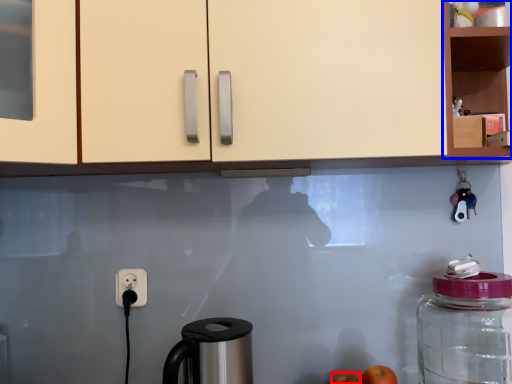
Question: Which point is closer to the camera, apple (highlighted by a red box) or cabinetry (highlighted by a blue box)?

Choices:
 (A) apple
 (B) cabinetry

Answer: (B)